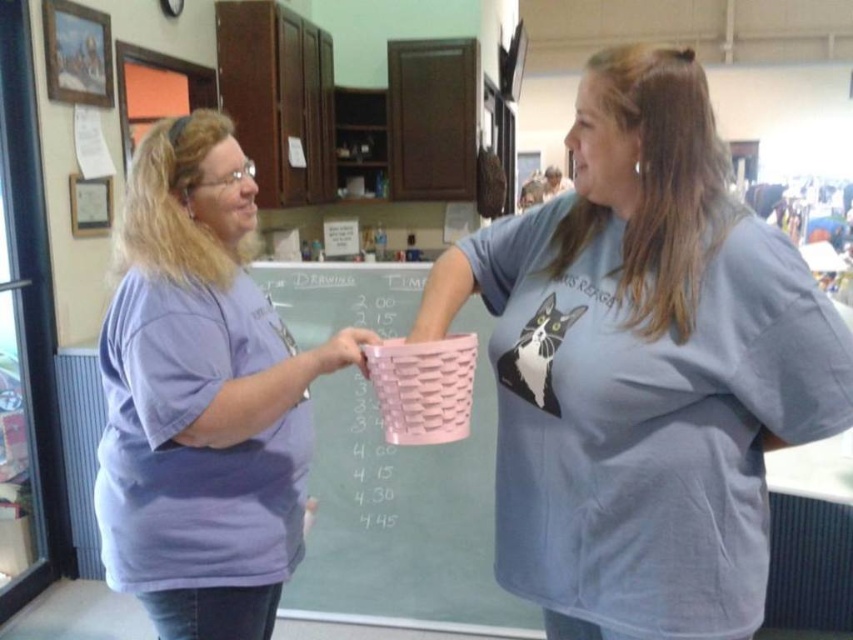
Measure the distance between purple matte shirt at left and camera.

purple matte shirt at left is 3.97 feet from camera.

How much distance is there between purple matte shirt at left and pink woven basket at center?

purple matte shirt at left and pink woven basket at center are 3.98 feet apart.

I want to click on purple matte shirt at left, so click(x=201, y=396).

Is matte pink basket at center behind pink woven basket at center?

No, it is in front of pink woven basket at center.

Is matte pink basket at center taller than pink woven basket at center?

No, matte pink basket at center is not taller than pink woven basket at center.

I want to click on matte pink basket at center, so click(x=643, y=368).

Between matte pink basket at center and purple matte shirt at left, which one is positioned higher?

matte pink basket at center is higher up.

Which of these two, matte pink basket at center or purple matte shirt at left, stands taller?

purple matte shirt at left is taller.

Who is more forward, (541, 541) or (241, 397)?

Positioned in front is point (241, 397).

This screenshot has width=853, height=640. I want to click on matte pink basket at center, so click(643, 368).